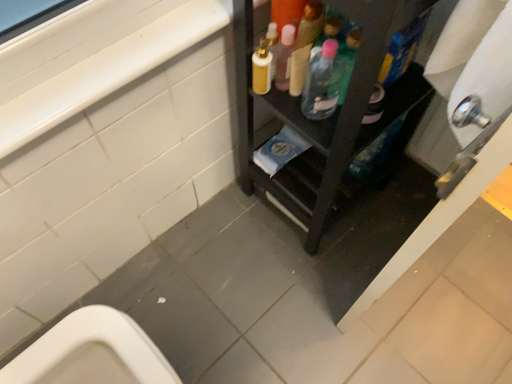
Question: Does translucent plastic bottle at center, marked as the 2th bottle in a right-to-left arrangement, come behind black wood shelf at center?

Choices:
 (A) no
 (B) yes

Answer: (B)

Question: Does translucent plastic bottle at center, marked as the 2th bottle in a right-to-left arrangement, have a smaller size compared to black wood shelf at center?

Choices:
 (A) no
 (B) yes

Answer: (B)

Question: Considering the relative sizes of translucent plastic bottle at center, marked as the 2th bottle in a right-to-left arrangement, and black wood shelf at center in the image provided, is translucent plastic bottle at center, marked as the 2th bottle in a right-to-left arrangement, thinner than black wood shelf at center?

Choices:
 (A) no
 (B) yes

Answer: (B)

Question: Is translucent plastic bottle at center, positioned as the first bottle in left-to-right order, looking in the opposite direction of black wood shelf at center?

Choices:
 (A) yes
 (B) no

Answer: (A)

Question: Considering the relative sizes of translucent plastic bottle at center, positioned as the first bottle in left-to-right order, and black wood shelf at center in the image provided, is translucent plastic bottle at center, positioned as the first bottle in left-to-right order, taller than black wood shelf at center?

Choices:
 (A) no
 (B) yes

Answer: (A)

Question: Can we say translucent plastic bottle at center, positioned as the first bottle in left-to-right order, lies outside black wood shelf at center?

Choices:
 (A) yes
 (B) no

Answer: (B)

Question: Does black wood shelf at center appear on the left side of translucent plastic bottle at upper center, the first bottle from the right?

Choices:
 (A) no
 (B) yes

Answer: (B)

Question: Could you tell me if black wood shelf at center is facing translucent plastic bottle at upper center, the first bottle from the right?

Choices:
 (A) no
 (B) yes

Answer: (B)

Question: Is black wood shelf at center positioned far away from translucent plastic bottle at upper center, the first bottle from the right?

Choices:
 (A) yes
 (B) no

Answer: (B)

Question: Does black wood shelf at center lie in front of translucent plastic bottle at upper center, positioned as the 2th bottle in left-to-right order?

Choices:
 (A) no
 (B) yes

Answer: (B)

Question: Is black wood shelf at center facing away from translucent plastic bottle at upper center, the first bottle from the right?

Choices:
 (A) no
 (B) yes

Answer: (B)

Question: From a real-world perspective, is black wood shelf at center below translucent plastic bottle at upper center, positioned as the 2th bottle in left-to-right order?

Choices:
 (A) no
 (B) yes

Answer: (B)

Question: Considering the relative positions of translucent plastic bottle at center, positioned as the first bottle in left-to-right order, and translucent plastic bottle at upper center, the first bottle from the right, in the image provided, is translucent plastic bottle at center, positioned as the first bottle in left-to-right order, behind translucent plastic bottle at upper center, the first bottle from the right,?

Choices:
 (A) yes
 (B) no

Answer: (A)